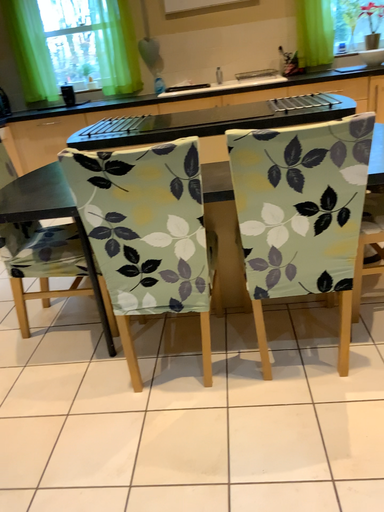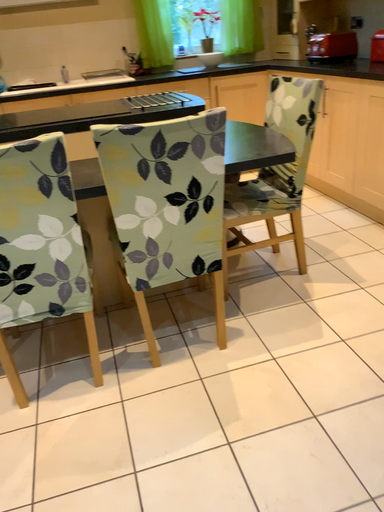
Question: Which way did the camera rotate in the video?

Choices:
 (A) rotated left
 (B) rotated right

Answer: (B)